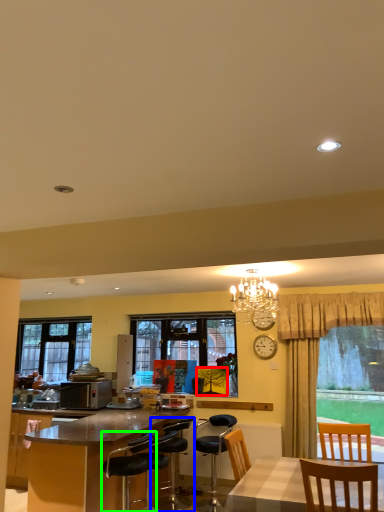
Question: Which is nearer to the picture frame (highlighted by a red box)? chair (highlighted by a blue box) or chair (highlighted by a green box).

Choices:
 (A) chair
 (B) chair

Answer: (A)